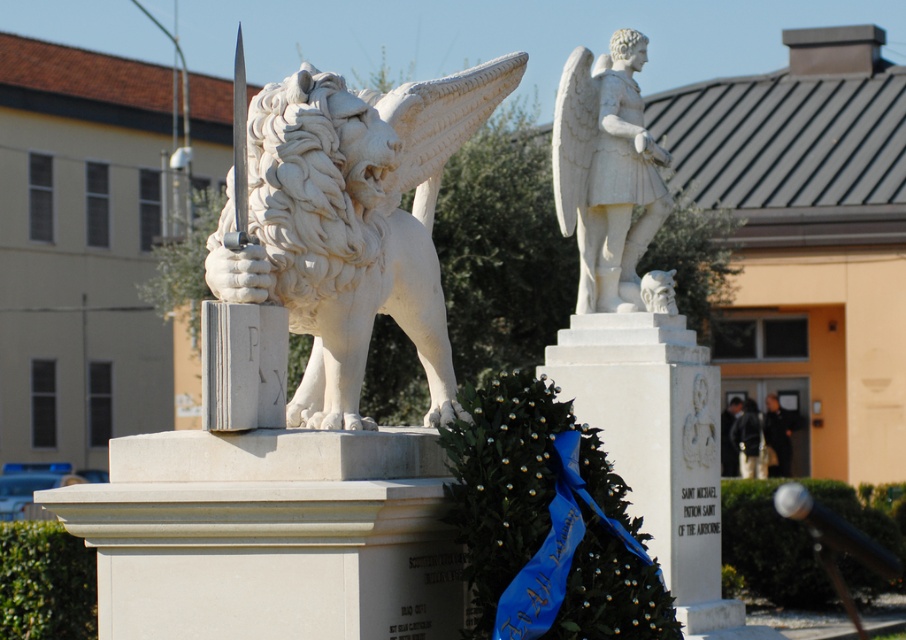
You are a visitor at the memorial site and want to take a photo that includes both the white marble lion at center and the white marble angel at upper right. Based on their positions, which statue should you position closer to the left side of your camera frame?

The white marble lion at center should be positioned closer to the left side of your camera frame because it is located to the left of the white marble angel at upper right in the scene.

You are standing at the base of the white marble lion at center. You want to throw a small pebble to hit the statue of the angel or warrior to your right. If you can throw a pebble 30 meters, will you be able to reach it?

The distance between you and the statue of the angel or warrior to your right is not specified, but the white marble lion at center is 31.21 meters away from the viewer. Since you can only throw 30 meters, you won not be able to reach the statue of the angel or warrior to your right.

Consider the image. You are a visitor at the memorial and want to take a photo of both the white marble pillar at center and the white marble angel at upper right. Which object will appear larger in your photo?

The white marble pillar at center will appear larger in the photo because it is closer to the viewer than the white marble angel at upper right.